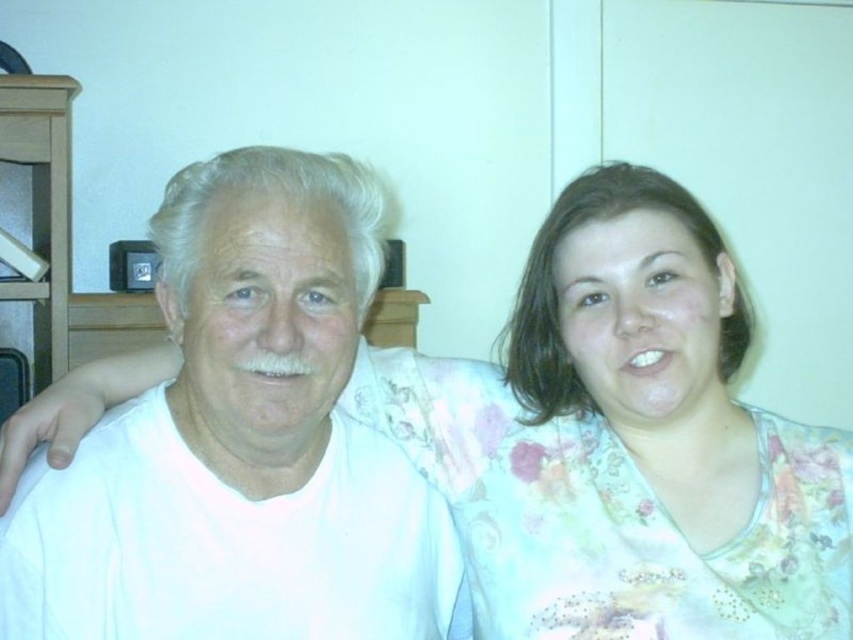
Question: Is white matte shirt at center behind floral fabric blouse at right?

Choices:
 (A) no
 (B) yes

Answer: (A)

Question: Which of the following is the farthest from the observer?

Choices:
 (A) white matte shirt at center
 (B) floral fabric blouse at right

Answer: (B)

Question: Which object appears closest to the camera in this image?

Choices:
 (A) white matte shirt at center
 (B) floral fabric blouse at right

Answer: (A)

Question: Is white matte shirt at center thinner than floral fabric blouse at right?

Choices:
 (A) yes
 (B) no

Answer: (B)

Question: Is white matte shirt at center to the left of floral fabric blouse at right from the viewer's perspective?

Choices:
 (A) yes
 (B) no

Answer: (A)